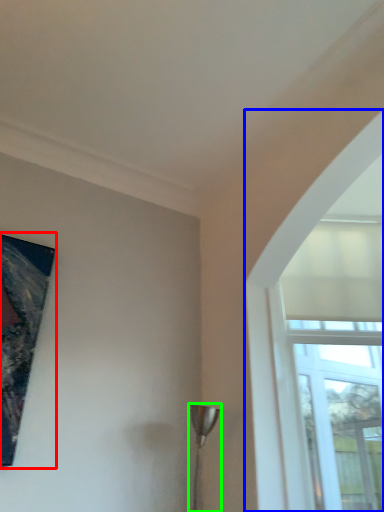
Question: Which object is the closest to the picture frame (highlighted by a red box)? Choose among these: window (highlighted by a blue box) or lamp (highlighted by a green box).

Choices:
 (A) window
 (B) lamp

Answer: (B)